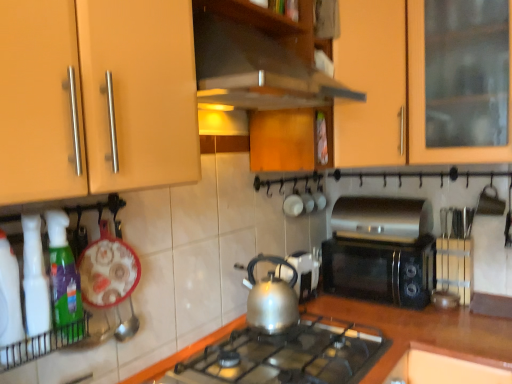
The height and width of the screenshot is (384, 512). I want to click on matte wood cabinet at upper left, which ranks as the first cabinetry in left-to-right order, so click(96, 97).

This screenshot has height=384, width=512. Find the location of `matte wood cabinet at upper center, positioned as the 2th cabinetry in front-to-back order`. matte wood cabinet at upper center, positioned as the 2th cabinetry in front-to-back order is located at coordinates (392, 89).

This screenshot has height=384, width=512. I want to click on metallic silver gas stove at center, so click(x=288, y=355).

Measure the distance between wooden exhaust hood at upper center and camera.

A distance of 3.31 feet exists between wooden exhaust hood at upper center and camera.

Find the location of a particular element. The height and width of the screenshot is (384, 512). black plastic microwave at center-right, acting as the third kitchen appliance starting from the front is located at coordinates (380, 251).

Considering the sizes of wooden exhaust hood at upper center and silver metallic kettle at center in the image, is wooden exhaust hood at upper center wider or thinner than silver metallic kettle at center?

In the image, wooden exhaust hood at upper center appears to be wider than silver metallic kettle at center.

Based on the photo, from the image's perspective, relative to silver metallic kettle at center, is wooden exhaust hood at upper center above or below?

From the image's perspective, wooden exhaust hood at upper center appears above silver metallic kettle at center.

Considering the sizes of objects wooden exhaust hood at upper center and silver metallic kettle at center in the image provided, who is shorter, wooden exhaust hood at upper center or silver metallic kettle at center?

silver metallic kettle at center is shorter.

Who is bigger, wooden exhaust hood at upper center or silver metallic kettle at center?

wooden exhaust hood at upper center.

Considering the relative positions of matte wood cabinet at upper left, the 2th cabinetry viewed from the back, and translucent green spray bottle at left, which is counted as the third kitchen appliance, starting from the right, in the image provided, is matte wood cabinet at upper left, the 2th cabinetry viewed from the back, in front of translucent green spray bottle at left, which is counted as the third kitchen appliance, starting from the right,?

Yes, the depth of matte wood cabinet at upper left, the 2th cabinetry viewed from the back, is less than that of translucent green spray bottle at left, which is counted as the third kitchen appliance, starting from the right.

Which of these two, matte wood cabinet at upper left, which ranks as the first cabinetry in left-to-right order, or translucent green spray bottle at left, marked as the 3th kitchen appliance in a back-to-front arrangement, is thinner?

translucent green spray bottle at left, marked as the 3th kitchen appliance in a back-to-front arrangement, is thinner.

From a real-world perspective, starting from the translucent green spray bottle at left, which is counted as the first kitchen appliance, starting from the front, which cabinetry is the 1st one vertically above it? Please provide its 2D coordinates.

[(96, 97)]

From the image's perspective, is matte wood cabinet at upper left, the 2th cabinetry viewed from the back, above or below translucent green spray bottle at left, arranged as the 1th kitchen appliance when viewed from the left?

Based on their image positions, matte wood cabinet at upper left, the 2th cabinetry viewed from the back, is located above translucent green spray bottle at left, arranged as the 1th kitchen appliance when viewed from the left.

Can you tell me how much translucent green spray bottle at left, which is counted as the third kitchen appliance, starting from the right, and matte wood cabinet at upper center, positioned as the 2th cabinetry in front-to-back order, differ in facing direction?

0.696 degrees separate the facing orientations of translucent green spray bottle at left, which is counted as the third kitchen appliance, starting from the right, and matte wood cabinet at upper center, positioned as the 2th cabinetry in front-to-back order.

Relative to matte wood cabinet at upper center, positioned as the 2th cabinetry in front-to-back order, is translucent green spray bottle at left, which is counted as the first kitchen appliance, starting from the front, in front or behind?

Clearly, translucent green spray bottle at left, which is counted as the first kitchen appliance, starting from the front, is in front of matte wood cabinet at upper center, positioned as the 2th cabinetry in front-to-back order.

Find the location of a particular element. The width and height of the screenshot is (512, 384). the 2nd cabinetry above the translucent green spray bottle at left, arranged as the 1th kitchen appliance when viewed from the left (from the image's perspective) is located at coordinates (392, 89).

Considering the relative sizes of translucent green spray bottle at left, marked as the 3th kitchen appliance in a back-to-front arrangement, and matte wood cabinet at upper center, positioned as the 2th cabinetry in front-to-back order, in the image provided, is translucent green spray bottle at left, marked as the 3th kitchen appliance in a back-to-front arrangement, taller than matte wood cabinet at upper center, positioned as the 2th cabinetry in front-to-back order,?

No, translucent green spray bottle at left, marked as the 3th kitchen appliance in a back-to-front arrangement, is not taller than matte wood cabinet at upper center, positioned as the 2th cabinetry in front-to-back order.

From a real-world perspective, is matte wood cabinet at upper left, the 2th cabinetry viewed from the back, positioned over translucent plastic spray bottle at lower left based on gravity?

Yes, from a real-world perspective, matte wood cabinet at upper left, the 2th cabinetry viewed from the back, is above translucent plastic spray bottle at lower left.

Looking at their sizes, would you say matte wood cabinet at upper left, the second cabinetry positioned from the right, is wider or thinner than translucent plastic spray bottle at lower left?

matte wood cabinet at upper left, the second cabinetry positioned from the right, is wider than translucent plastic spray bottle at lower left.

From the image's perspective, which one is positioned lower, matte wood cabinet at upper left, the second cabinetry positioned from the right, or translucent plastic spray bottle at lower left?

translucent plastic spray bottle at lower left.

Is matte wood cabinet at upper left, the second cabinetry positioned from the right, further to the viewer compared to translucent plastic spray bottle at lower left?

No, it is not.

Is matte wood cabinet at upper center, the 1th cabinetry when ordered from right to left, to the right of silver metallic kettle at center, which is the 2th kitchen appliance from left to right, from the viewer's perspective?

Yes.

From a real-world perspective, which is physically above, matte wood cabinet at upper center, the 1th cabinetry when ordered from right to left, or silver metallic kettle at center, arranged as the second kitchen appliance when viewed from the front?

In real-world perspective, matte wood cabinet at upper center, the 1th cabinetry when ordered from right to left, is above.

Locate an element on the screen. cabinetry that is the 1st one when counting forward from the silver metallic kettle at center, which is the 2th kitchen appliance from left to right is located at coordinates (392, 89).

In the image, there is a matte wood cabinet at upper left, the 1th cabinetry when ordered from front to back. In order to click on gas stove below it (from a real-world perspective) in this screenshot , I will do `click(288, 355)`.

Between point (188, 57) and point (174, 381), which one is positioned in front?

The point (188, 57) is more forward.

From a real-world perspective, is matte wood cabinet at upper left, the second cabinetry positioned from the right, over metallic silver gas stove at center?

Yes.

Is black plastic microwave at center-right, the 3th kitchen appliance positioned from the left, inside translucent plastic spray bottle at lower left?

No, translucent plastic spray bottle at lower left does not contain black plastic microwave at center-right, the 3th kitchen appliance positioned from the left.

Which is more to the right, translucent plastic spray bottle at lower left or black plastic microwave at center-right, acting as the third kitchen appliance starting from the front?

From the viewer's perspective, black plastic microwave at center-right, acting as the third kitchen appliance starting from the front, appears more on the right side.

Considering the sizes of objects translucent plastic spray bottle at lower left and black plastic microwave at center-right, the first kitchen appliance in the right-to-left sequence, in the image provided, who is wider, translucent plastic spray bottle at lower left or black plastic microwave at center-right, the first kitchen appliance in the right-to-left sequence,?

With larger width is black plastic microwave at center-right, the first kitchen appliance in the right-to-left sequence.

Locate an element on the screen. The width and height of the screenshot is (512, 384). appliance located underneath the wooden exhaust hood at upper center (from a real-world perspective) is located at coordinates (304, 273).

Locate an element on the screen. the 1st kitchen appliance behind the matte wood cabinet at upper left, the 2th cabinetry viewed from the back, counting from the anchor's position is located at coordinates (64, 279).

Based on their spatial positions, is silver metallic kettle at center or matte wood cabinet at upper center, positioned as the 2th cabinetry in front-to-back order, further from metallic silver gas stove at center?

matte wood cabinet at upper center, positioned as the 2th cabinetry in front-to-back order, is further to metallic silver gas stove at center.

Looking at the image, which one is located closer to silver metallic kettle at center, wooden at center or matte wood cabinet at upper center, positioned as the 2th cabinetry in front-to-back order?

wooden at center is positioned closer to the anchor silver metallic kettle at center.

Considering their positions, is translucent green spray bottle at left, which is counted as the first kitchen appliance, starting from the front, positioned further to matte wood cabinet at upper center, positioned as the 2th cabinetry in front-to-back order, than matte wood cabinet at upper left, which ranks as the first cabinetry in left-to-right order?

translucent green spray bottle at left, which is counted as the first kitchen appliance, starting from the front, is positioned further to the anchor matte wood cabinet at upper center, positioned as the 2th cabinetry in front-to-back order.

From the image, which object appears to be nearer to translucent green spray bottle at left, arranged as the 1th kitchen appliance when viewed from the left, metallic silver gas stove at center or translucent plastic spray bottle at lower left?

translucent plastic spray bottle at lower left is positioned closer to the anchor translucent green spray bottle at left, arranged as the 1th kitchen appliance when viewed from the left.

Looking at the image, which one is located closer to black plastic microwave at center-right, acting as the third kitchen appliance starting from the front, silver metallic kettle at center, arranged as the second kitchen appliance when viewed from the front, or matte wood cabinet at upper left, which ranks as the first cabinetry in left-to-right order?

Based on the image, silver metallic kettle at center, arranged as the second kitchen appliance when viewed from the front, appears to be nearer to black plastic microwave at center-right, acting as the third kitchen appliance starting from the front.

When comparing their distances from silver metallic kettle at center, does wooden at center or translucent plastic spray bottle at lower left seem closer?

Based on the image, wooden at center appears to be nearer to silver metallic kettle at center.

When comparing their distances from matte wood cabinet at upper center, which is counted as the 2th cabinetry, starting from the left, does metallic silver gas stove at center or translucent green spray bottle at left, which is counted as the third kitchen appliance, starting from the right, seem closer?

Among the two, metallic silver gas stove at center is located nearer to matte wood cabinet at upper center, which is counted as the 2th cabinetry, starting from the left.

Looking at the image, which one is located further to metallic silver gas stove at center, silver metallic kettle at center, arranged as the 2th kitchen appliance when viewed from the right, or translucent plastic spray bottle at lower left?

Among the two, translucent plastic spray bottle at lower left is located further to metallic silver gas stove at center.

What are the coordinates of `appliance situated between silver metallic kettle at center, which is the 2th kitchen appliance from left to right, and wooden at center from left to right` in the screenshot? It's located at (304, 273).

Identify the location of appliance between matte wood cabinet at upper center, positioned as the 2th cabinetry in front-to-back order, and wooden at center, in the vertical direction. This screenshot has height=384, width=512. (304, 273).

The width and height of the screenshot is (512, 384). I want to click on exhaust hood between translucent plastic spray bottle at lower left and silver metallic kettle at center along the z-axis, so click(x=256, y=70).

Identify the location of appliance between wooden exhaust hood at upper center and wooden at center in the up-down direction. The width and height of the screenshot is (512, 384). (304, 273).